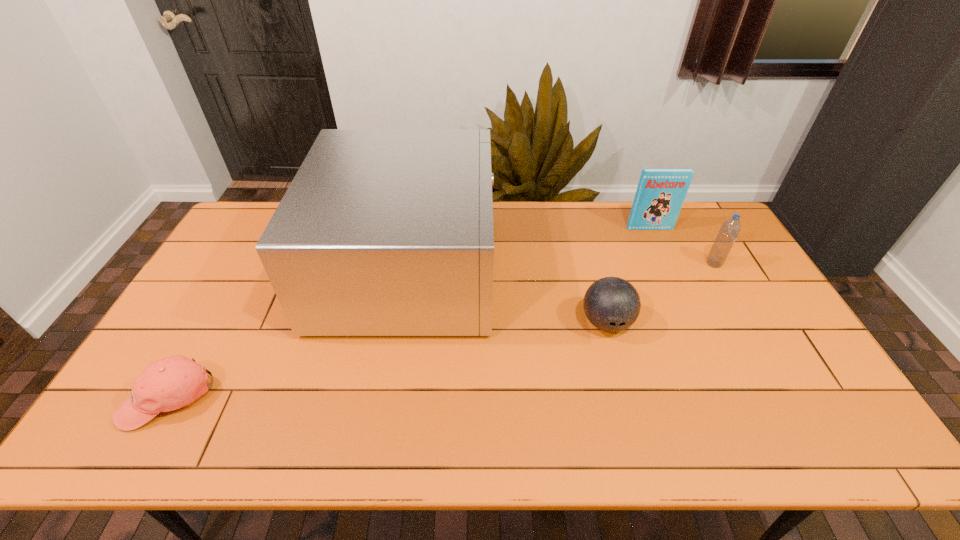
Find the location of a particular element. Image resolution: width=960 pixels, height=540 pixels. microwave oven is located at coordinates (382, 232).

In order to click on the tallest object in this screenshot , I will do (382, 232).

You are a GUI agent. You are given a task and a screenshot of the screen. Output one action in this format:
    pyautogui.click(x=<x>, y=<y>)
    Task: Click on the book
    
    Given the screenshot: What is the action you would take?
    pyautogui.click(x=660, y=194)

Identify the location of the fourth object from left to right. The width and height of the screenshot is (960, 540). (660, 194).

This screenshot has width=960, height=540. I want to click on the rightmost object, so click(728, 233).

This screenshot has height=540, width=960. What are the coordinates of `the third tallest object` in the screenshot? It's located at (728, 233).

Locate an element on the screen. The image size is (960, 540). the second shortest object is located at coordinates (612, 304).

The height and width of the screenshot is (540, 960). I want to click on the third object from left to right, so click(x=612, y=304).

You are a GUI agent. You are given a task and a screenshot of the screen. Output one action in this format:
    pyautogui.click(x=<x>, y=<y>)
    Task: Click on the nearest object
    
    Given the screenshot: What is the action you would take?
    pyautogui.click(x=167, y=384)

I want to click on the leftmost object, so click(x=167, y=384).